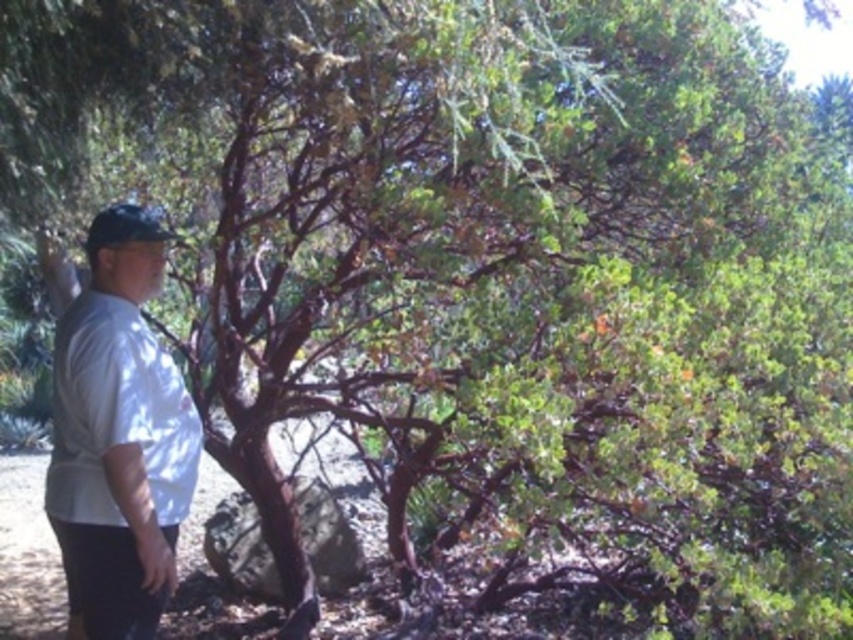
You are a photographer trying to capture the man in the scene. You want to ensure that both the white cotton shirt at left and the black matte baseball hat at left are visible in your photo. Based on their positions, which object should you focus on first to frame the shot properly?

The white cotton shirt at left is to the left of the black matte baseball hat at left, so you should focus on the white cotton shirt at left first to ensure both are in frame.

You are a photographer aiming to capture the man in the scene. Since there are two shirts at the left side, the white cotton shirt at left and the white matte shirt at left, which one should you focus on to ensure the man is fully visible in your photo?

The white cotton shirt at left is located below the white matte shirt at left, so focusing on the white cotton shirt at left would ensure the man is fully visible as it is positioned lower and likely part of his clothing that isn not obscured.